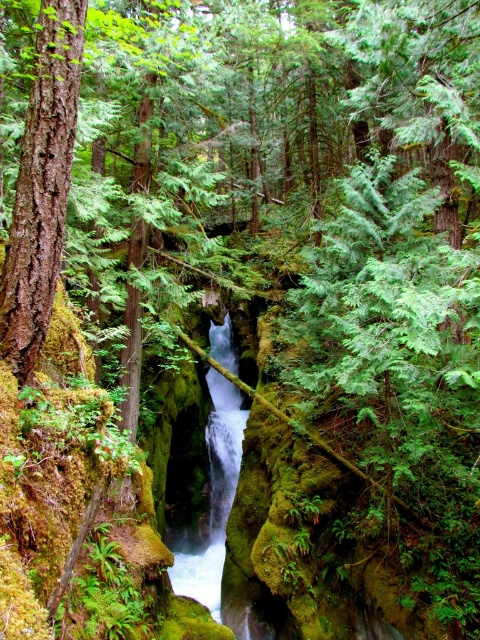
Is smooth brown bark at left shorter than white glossy stream at center?

Yes.

Does smooth brown bark at left appear under white glossy stream at center?

No, smooth brown bark at left is not below white glossy stream at center.

Is point (11, 301) in front of point (214, 445)?

Yes, point (11, 301) is in front of point (214, 445).

This screenshot has height=640, width=480. Find the location of `smooth brown bark at left`. smooth brown bark at left is located at coordinates (41, 186).